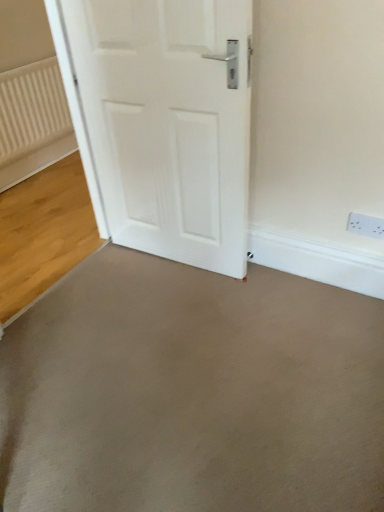
Question: From the image's perspective, is gray smooth concrete at center, which appears as the first concrete when viewed from the back, on top of smooth concrete floor at center, the 1th concrete positioned from the front?

Choices:
 (A) yes
 (B) no

Answer: (A)

Question: From a real-world perspective, is gray smooth concrete at center, which appears as the first concrete when viewed from the back, located beneath smooth concrete floor at center, the 1th concrete positioned from the front?

Choices:
 (A) yes
 (B) no

Answer: (A)

Question: From the image's perspective, is gray smooth concrete at center, the 2th concrete viewed from the front, below smooth concrete floor at center, the 1th concrete positioned from the front?

Choices:
 (A) yes
 (B) no

Answer: (B)

Question: Is gray smooth concrete at center, which appears as the first concrete when viewed from the back, at the left side of smooth concrete floor at center, arranged as the second concrete when viewed from the back?

Choices:
 (A) yes
 (B) no

Answer: (A)

Question: Is gray smooth concrete at center, which appears as the first concrete when viewed from the back, behind smooth concrete floor at center, the 1th concrete positioned from the front?

Choices:
 (A) yes
 (B) no

Answer: (A)

Question: Is gray smooth concrete at center, the 2th concrete viewed from the front, thinner than smooth concrete floor at center, the 1th concrete positioned from the front?

Choices:
 (A) no
 (B) yes

Answer: (B)

Question: Considering the relative sizes of white matte door at center and smooth concrete floor at center, arranged as the second concrete when viewed from the back, in the image provided, is white matte door at center smaller than smooth concrete floor at center, arranged as the second concrete when viewed from the back,?

Choices:
 (A) no
 (B) yes

Answer: (A)

Question: From a real-world perspective, is white matte door at center positioned over smooth concrete floor at center, arranged as the second concrete when viewed from the back, based on gravity?

Choices:
 (A) yes
 (B) no

Answer: (A)

Question: Is white matte door at center thinner than smooth concrete floor at center, the 1th concrete positioned from the front?

Choices:
 (A) no
 (B) yes

Answer: (B)

Question: Does white matte door at center lie in front of smooth concrete floor at center, the 1th concrete positioned from the front?

Choices:
 (A) yes
 (B) no

Answer: (B)

Question: Is white matte door at center wider than smooth concrete floor at center, the 1th concrete positioned from the front?

Choices:
 (A) yes
 (B) no

Answer: (B)

Question: Could you tell me if white matte door at center is facing smooth concrete floor at center, the 1th concrete positioned from the front?

Choices:
 (A) yes
 (B) no

Answer: (A)

Question: Is smooth concrete floor at center, the 1th concrete positioned from the front, facing away from gray smooth concrete at center, which appears as the first concrete when viewed from the back?

Choices:
 (A) no
 (B) yes

Answer: (A)